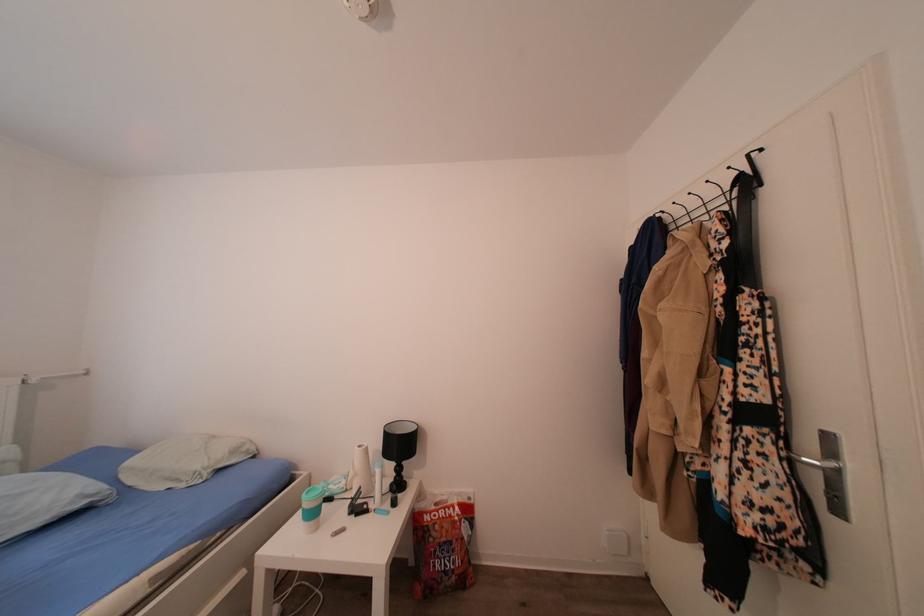
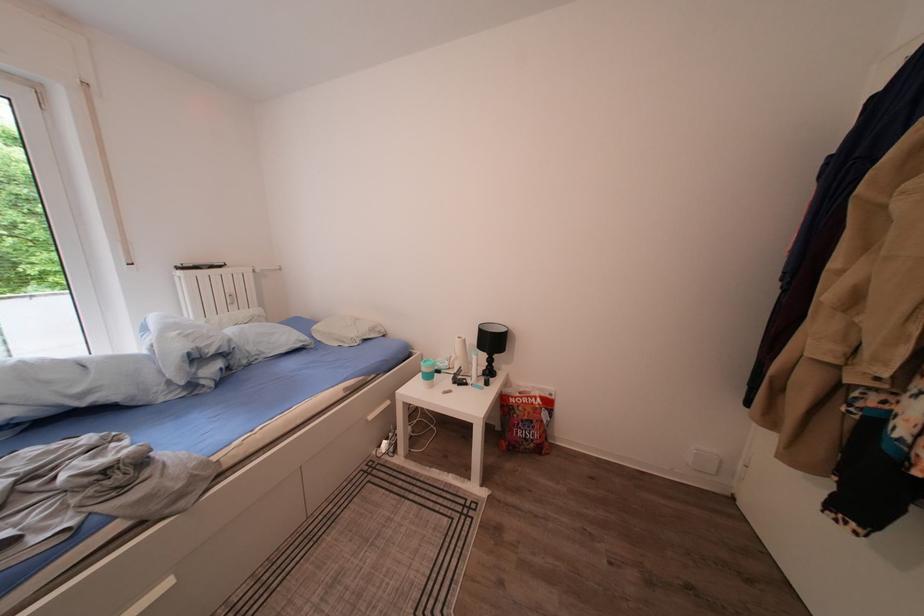
In the second image, find the point that corresponds to [409,450] in the first image.

(502, 347)